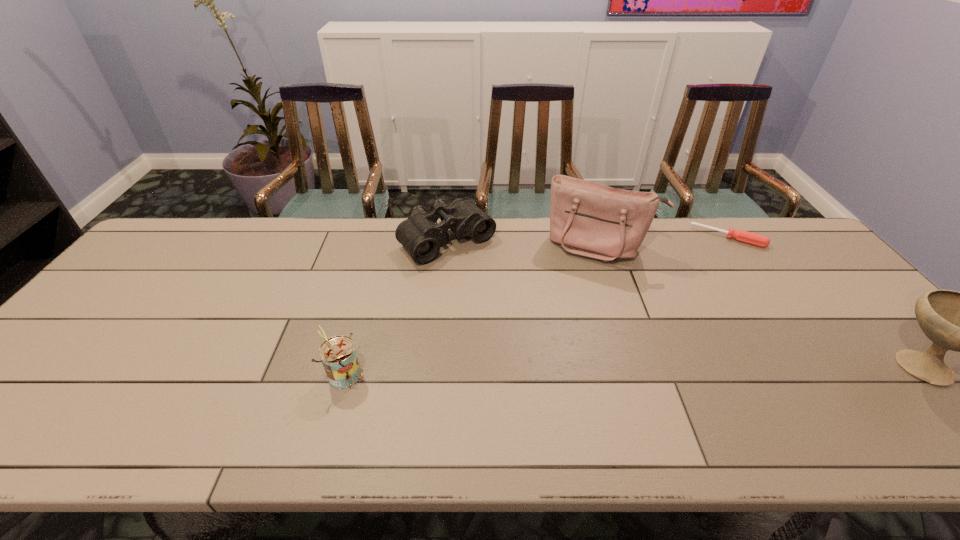
The height and width of the screenshot is (540, 960). Find the location of `free space located 0.110m at the eyepieces of the second object from left to right`. free space located 0.110m at the eyepieces of the second object from left to right is located at coordinates (493, 285).

What are the coordinates of `free space located at the eyepieces of the second object from left to right` in the screenshot? It's located at (545, 339).

Identify the location of vacant space located 0.380m at the blade of the second object from right to left. This screenshot has height=540, width=960. (700, 325).

You are a GUI agent. You are given a task and a screenshot of the screen. Output one action in this format:
    pyautogui.click(x=<x>, y=<y>)
    Task: Click on the free spot located at the blade of the second object from right to left
    This screenshot has width=960, height=540.
    Given the screenshot: What is the action you would take?
    pyautogui.click(x=703, y=315)

The width and height of the screenshot is (960, 540). Find the location of `vacant space located at the blade of the second object from right to left`. vacant space located at the blade of the second object from right to left is located at coordinates pyautogui.click(x=704, y=310).

The height and width of the screenshot is (540, 960). In order to click on blank area located on the front pocket of the third object from right to left in this screenshot , I will do `click(564, 337)`.

Find the location of a particular element. vacant space situated 0.230m on the front pocket of the third object from right to left is located at coordinates (569, 318).

Where is `free point located on the front pocket of the third object from right to left`? This screenshot has height=540, width=960. free point located on the front pocket of the third object from right to left is located at coordinates (577, 294).

Where is `binoculars that is at the far edge`? The height and width of the screenshot is (540, 960). binoculars that is at the far edge is located at coordinates (420, 234).

In order to click on screwdriver that is at the far edge in this screenshot , I will do `click(743, 236)`.